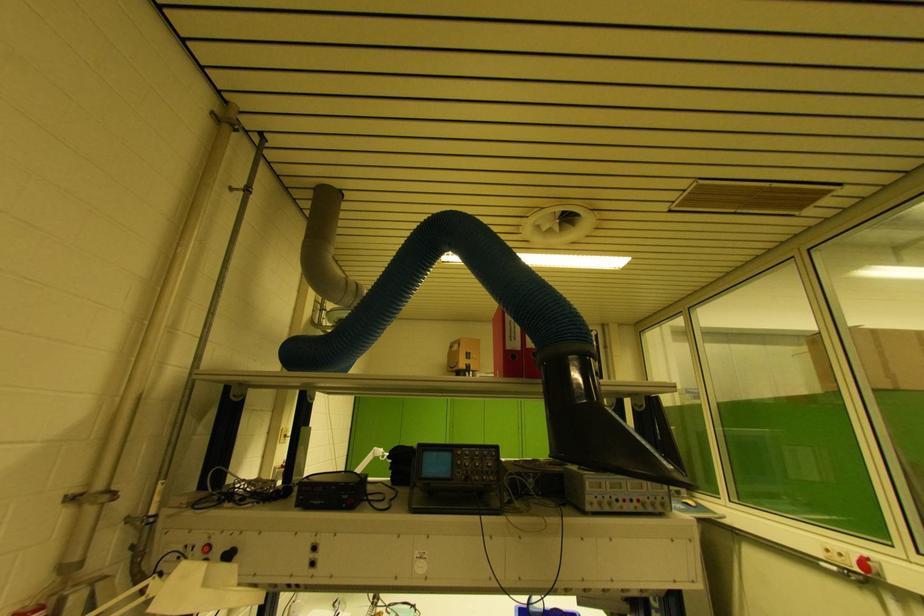
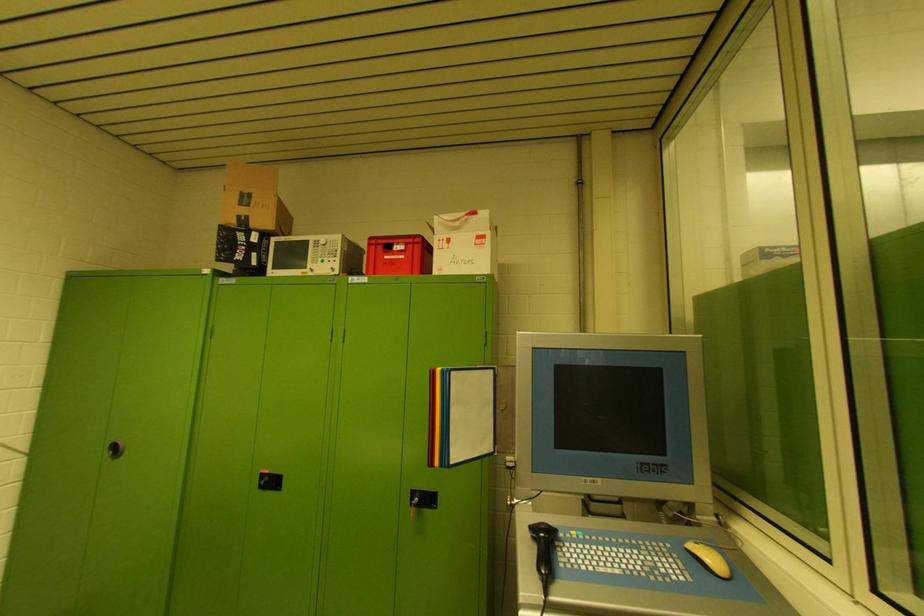
What movement of the cameraman would produce the second image?

The cameraman walked toward right, forward.